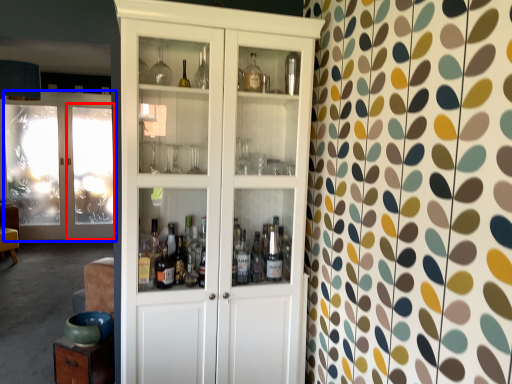
Question: Which object appears farthest to the camera in this image, screen door (highlighted by a red box) or door (highlighted by a blue box)?

Choices:
 (A) screen door
 (B) door

Answer: (A)